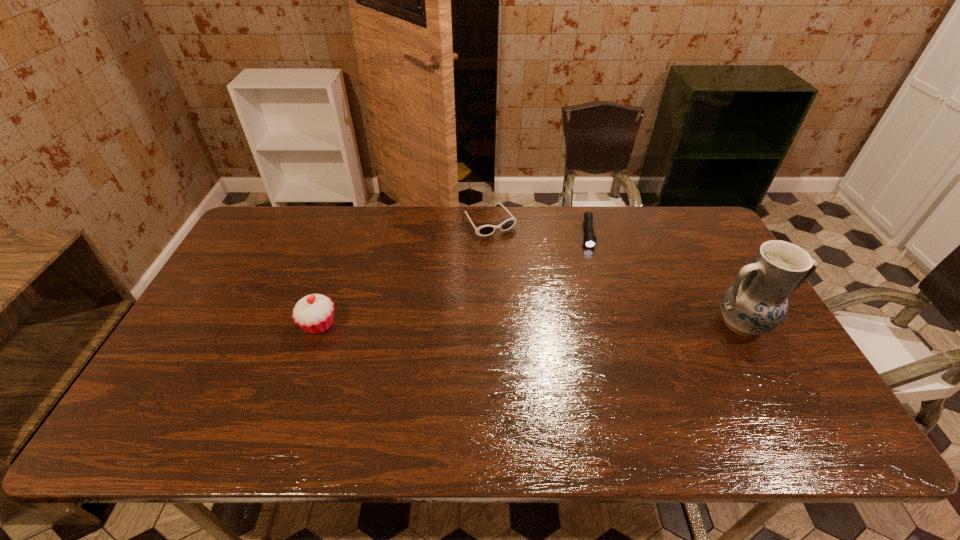
What are the coordinates of `the leftmost object` in the screenshot? It's located at (314, 313).

Locate an element on the screen. the second tallest object is located at coordinates (314, 313).

I want to click on the tallest object, so click(756, 303).

This screenshot has height=540, width=960. I want to click on the rightmost object, so click(756, 303).

You are a GUI agent. You are given a task and a screenshot of the screen. Output one action in this format:
    pyautogui.click(x=<x>, y=<y>)
    Task: Click on the third object from right to left
    
    Given the screenshot: What is the action you would take?
    pyautogui.click(x=485, y=230)

This screenshot has width=960, height=540. What are the coordinates of `sunglasses` in the screenshot? It's located at (485, 230).

Where is `the second object from right to left`? This screenshot has height=540, width=960. the second object from right to left is located at coordinates (589, 239).

Identify the location of flashlight. (589, 239).

Where is `free point located on the back of the cupcake`? free point located on the back of the cupcake is located at coordinates (346, 246).

Where is `vacant area located 0.200m on the back of the rightmost object`? vacant area located 0.200m on the back of the rightmost object is located at coordinates (706, 258).